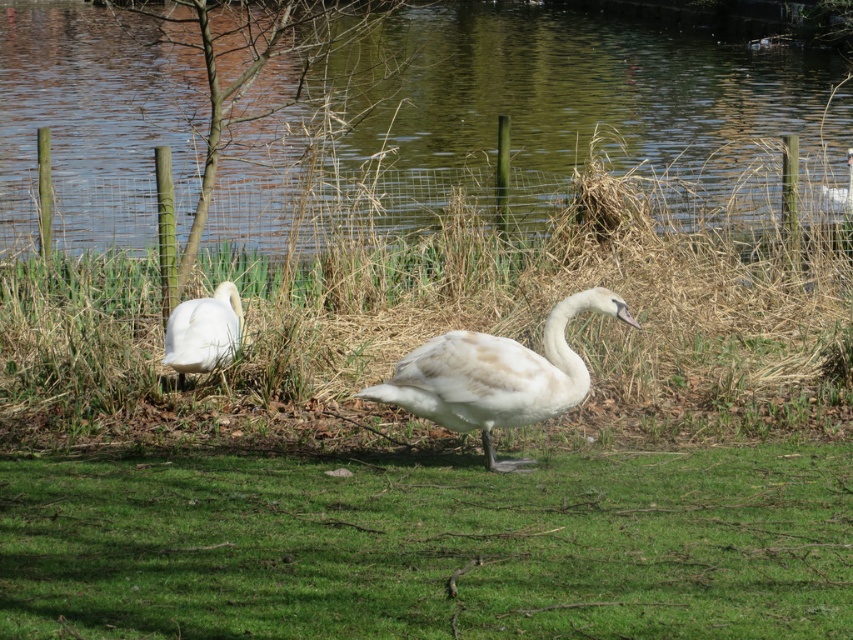
Question: Among these points, which one is farthest from the camera?

Choices:
 (A) (227, 294)
 (B) (577, 387)

Answer: (A)

Question: Which point appears farthest from the camera in this image?

Choices:
 (A) (456, 632)
 (B) (590, 49)
 (C) (167, 323)
 (D) (833, 195)

Answer: (B)

Question: Which of the following is the closest to the observer?

Choices:
 (A) white feathered swan at left
 (B) white matte swan at center
 (C) green water at center
 (D) white feathered swan at upper right

Answer: (B)

Question: Does green grass at center have a greater width compared to white feathered swan at upper right?

Choices:
 (A) no
 (B) yes

Answer: (B)

Question: In this image, where is white matte swan at center located relative to white feathered swan at upper right?

Choices:
 (A) left
 (B) right

Answer: (A)

Question: Can you confirm if green water at center is positioned to the left of white matte swan at center?

Choices:
 (A) no
 (B) yes

Answer: (B)